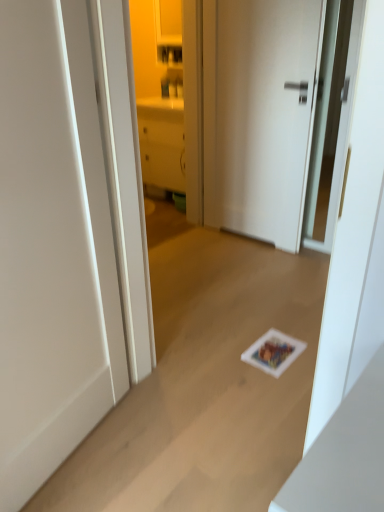
Question: In terms of height, does white matte door at center, acting as the second door starting from the right, look taller or shorter compared to matte white cabinet at center?

Choices:
 (A) short
 (B) tall

Answer: (A)

Question: From a real-world perspective, is white matte door at center, which is the 2th door from back to front, physically located above or below matte white cabinet at center?

Choices:
 (A) above
 (B) below

Answer: (B)

Question: Which is farther from the white matte door at center, the second door in the front-to-back sequence?

Choices:
 (A) white matte door at center, acting as the second door starting from the right
 (B) matte white cabinet at center

Answer: (A)

Question: Which object is the farthest from the white matte door at center, the first door from the front?

Choices:
 (A) matte white cabinet at center
 (B) white matte door at center, which is the first door from right to left

Answer: (A)